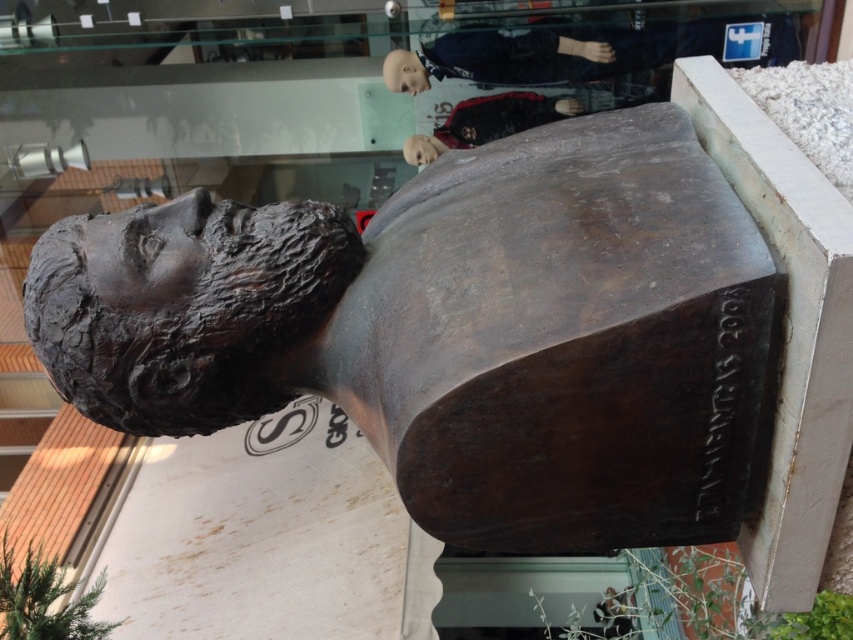
The width and height of the screenshot is (853, 640). What do you see at coordinates (184, 307) in the screenshot? I see `bronze sculpture at center` at bounding box center [184, 307].

Between bronze sculpture at center and matte plastic head at upper center, which one appears on the left side from the viewer's perspective?

bronze sculpture at center

Between point (38, 301) and point (428, 88), which one is positioned behind?

The point (428, 88) is more distant.

This screenshot has height=640, width=853. I want to click on bronze sculpture at center, so click(x=184, y=307).

Who is higher up, bronze sculpture at center or bronze statue at upper center?

bronze statue at upper center is above.

Between point (55, 340) and point (404, 157), which one is positioned in front?

Point (55, 340) is more forward.

Does point (142, 276) come behind point (412, 150)?

No.

In order to click on bronze sculpture at center in this screenshot , I will do `click(184, 307)`.

Is bronze statue at center taller than matte plastic head at upper center?

Yes, bronze statue at center is taller than matte plastic head at upper center.

Does bronze statue at center have a greater width compared to matte plastic head at upper center?

Yes.

Who is more forward, (682, 154) or (428, 88)?

Point (682, 154) is more forward.

I want to click on bronze statue at center, so click(457, 332).